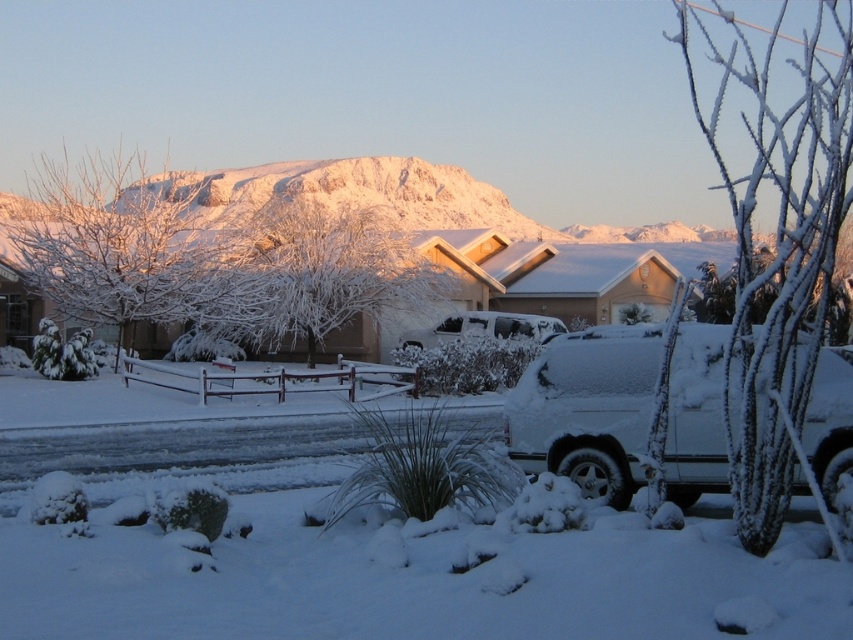
You are a delivery driver needing to park your vehicle in a tight space between the white matte suv at center and the white matte car at center. Which vehicle should you position your car next to if you want to park on the left side of the existing vehicles?

You should park next to the white matte car at center because the white matte suv at center is to the right of the white matte car at center, so the car is on the left side.

You are standing at the point marked by the coordinates point [587,408]. Looking around, you see the white matte suv at center. What object is located exactly at your current position?

The point [587,408] marks the location of the white matte suv at center.

You are a delivery person who needs to park a white matte suv at center and a white matte car at center in a garage with a height limit of 1.8 meters. Based on the scene, which vehicle might not fit due to height restrictions?

The white matte suv at center is much taller than the white matte car at center, so the white matte suv at center might not fit in the garage with a height limit of 1.8 meters.